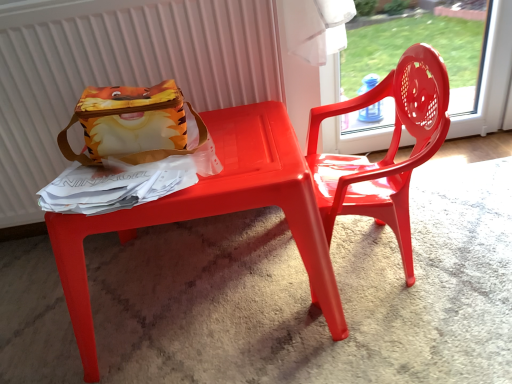
Question: From a real-world perspective, is glossy plastic chair at right physically located above or below matte plastic radiator at upper left?

Choices:
 (A) below
 (B) above

Answer: (A)

Question: Which is correct: glossy plastic chair at right is inside matte plastic radiator at upper left, or outside of it?

Choices:
 (A) outside
 (B) inside

Answer: (A)

Question: Estimate the real-world distances between objects in this image. Which object is closer to the matte plastic table at center?

Choices:
 (A) matte fabric lunchbox at upper left
 (B) glossy plastic chair at right
 (C) matte plastic radiator at upper left

Answer: (A)

Question: Which object is positioned closest to the matte fabric lunchbox at upper left?

Choices:
 (A) glossy plastic chair at right
 (B) matte plastic table at center
 (C) matte plastic radiator at upper left

Answer: (B)